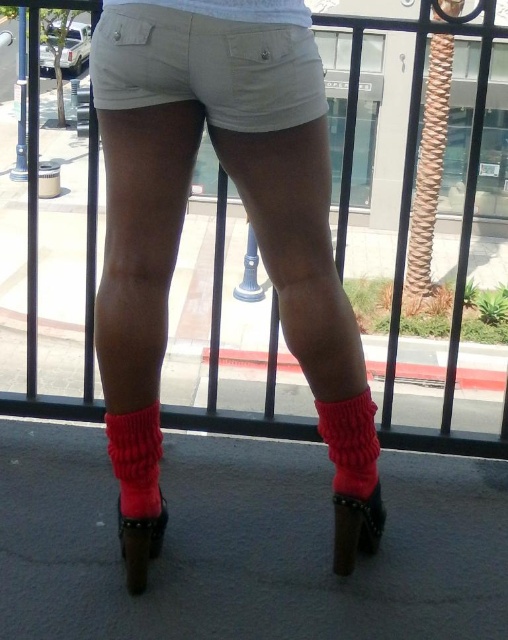
You are a fashion designer observing the person on the balcony. You need to determine the correct order of the crimson knitted sock at lower center and the cotton knit leg warmer at lower center from the bottom up. Which one is positioned lower?

The crimson knitted sock at lower center is located below the cotton knit leg warmer at lower center, so the crimson knitted sock at lower center is positioned lower.